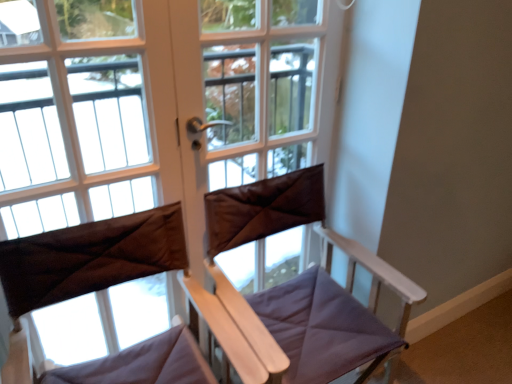
Image resolution: width=512 pixels, height=384 pixels. What are the coordinates of `purple fabric chair at center` in the screenshot? It's located at (302, 284).

Find the location of a particular element. Image resolution: width=512 pixels, height=384 pixels. brown fabric curtain at center is located at coordinates (88, 258).

You are a GUI agent. You are given a task and a screenshot of the screen. Output one action in this format:
    pyautogui.click(x=<x>, y=<y>)
    Task: Click on the purple fabric chair at center
    The image size is (512, 384).
    Given the screenshot: What is the action you would take?
    pyautogui.click(x=302, y=284)

Can you confirm if brown leather screen door at center is bigger than matte brown curtain at left?

Correct, brown leather screen door at center is larger in size than matte brown curtain at left.

Measure the distance between brown leather screen door at center and matte brown curtain at left.

brown leather screen door at center and matte brown curtain at left are 3.30 feet apart from each other.

Does brown leather screen door at center have a greater height compared to matte brown curtain at left?

No.

Consider the image. Can you confirm if brown leather screen door at center is positioned to the right of matte brown curtain at left?

Yes, brown leather screen door at center is to the right of matte brown curtain at left.

Would you consider matte brown curtain at left to be distant from brown fabric curtain at center?

Yes, matte brown curtain at left is far from brown fabric curtain at center.

Is matte brown curtain at left to the left of brown fabric curtain at center from the viewer's perspective?

Indeed, matte brown curtain at left is positioned on the left side of brown fabric curtain at center.

Is the depth of matte brown curtain at left less than that of brown fabric curtain at center?

No, it is not.

Which is in front, point (167, 218) or point (31, 141)?

Point (167, 218)

Between brown fabric curtain at center and matte brown curtain at left, which one appears on the right side from the viewer's perspective?

From the viewer's perspective, brown fabric curtain at center appears more on the right side.

Is brown fabric curtain at center situated inside matte brown curtain at left or outside?

brown fabric curtain at center is outside matte brown curtain at left.

From a real-world perspective, is brown fabric curtain at center physically located above or below matte brown curtain at left?

brown fabric curtain at center is situated lower than matte brown curtain at left in the real world.

From a real-world perspective, is purple fabric chair at center positioned over matte brown curtain at left based on gravity?

No, from a real-world perspective, purple fabric chair at center is not above matte brown curtain at left.

From the image's perspective, is purple fabric chair at center positioned above or below matte brown curtain at left?

From the image's perspective, purple fabric chair at center appears below matte brown curtain at left.

Measure the distance from purple fabric chair at center to matte brown curtain at left.

The distance of purple fabric chair at center from matte brown curtain at left is 1.33 meters.

From the picture: Which is closer to the camera, (391, 351) or (55, 109)?

Point (391, 351)

Is brown fabric at center to the left or to the right of purple fabric chair at center in the image?

brown fabric at center is to the left of purple fabric chair at center.

Considering the sizes of objects brown fabric at center and purple fabric chair at center in the image provided, who is smaller, brown fabric at center or purple fabric chair at center?

brown fabric at center is smaller.

Is the surface of brown fabric at center in direct contact with purple fabric chair at center?

No, brown fabric at center is not beside purple fabric chair at center.

In the scene shown: From the image's perspective, would you say brown fabric at center is positioned over purple fabric chair at center?

Yes, from the image's perspective, brown fabric at center is over purple fabric chair at center.

How distant is purple fabric chair at center from brown leather screen door at center?

The distance of purple fabric chair at center from brown leather screen door at center is 14.62 inches.

Does purple fabric chair at center have a larger size compared to brown leather screen door at center?

Yes, purple fabric chair at center is bigger than brown leather screen door at center.

How different are the orientations of purple fabric chair at center and brown leather screen door at center in degrees?

1.66 degrees.

From the picture: Are purple fabric chair at center and brown leather screen door at center making contact?

There is a gap between purple fabric chair at center and brown leather screen door at center.

In the scene shown: Is matte brown curtain at left touching purple fabric chair at center?

They are not placed beside each other.

Can you confirm if matte brown curtain at left is shorter than purple fabric chair at center?

Incorrect, the height of matte brown curtain at left does not fall short of that of purple fabric chair at center.

Which is behind, point (95, 111) or point (272, 288)?

The point (95, 111) is farther.

The height and width of the screenshot is (384, 512). What are the coordinates of `bay window that is below the brown leather screen door at center (from the image's perspective)` in the screenshot? It's located at (72, 116).

Where is `curtain in front of the matte brown curtain at left`? curtain in front of the matte brown curtain at left is located at coordinates (88, 258).

Looking at the image, which one is located closer to brown leather screen door at center, purple fabric chair at center or brown fabric curtain at center?

brown fabric curtain at center.

Looking at the image, which one is located further to purple fabric chair at center, brown fabric at center or brown fabric curtain at center?

brown fabric at center lies further to purple fabric chair at center than the other object.

Consider the image. Estimate the real-world distances between objects in this image. Which object is further from brown fabric curtain at center, brown leather screen door at center or matte brown curtain at left?

matte brown curtain at left is further to brown fabric curtain at center.

Estimate the real-world distances between objects in this image. Which object is closer to purple fabric chair at center, brown fabric at center or brown leather screen door at center?

Among the two, brown fabric at center is located nearer to purple fabric chair at center.

Based on the photo, considering their positions, is brown fabric at center positioned closer to matte brown curtain at left than brown leather screen door at center?

Among the two, brown fabric at center is located nearer to matte brown curtain at left.

When comparing their distances from brown fabric curtain at center, does purple fabric chair at center or brown leather screen door at center seem closer?

purple fabric chair at center is closer to brown fabric curtain at center.

Looking at the image, which one is located closer to brown fabric at center, brown leather screen door at center or matte brown curtain at left?

brown leather screen door at center lies closer to brown fabric at center than the other object.

In the scene shown: Estimate the real-world distances between objects in this image. Which object is further from brown leather screen door at center, brown fabric at center or purple fabric chair at center?

Among the two, purple fabric chair at center is located further to brown leather screen door at center.

Locate an element on the screen. This screenshot has width=512, height=384. bay window that lies between brown fabric at center and brown fabric curtain at center from top to bottom is located at coordinates (72, 116).

This screenshot has width=512, height=384. I want to click on curtain situated between matte brown curtain at left and purple fabric chair at center from left to right, so click(88, 258).

Image resolution: width=512 pixels, height=384 pixels. Find the location of `feeding chair between brown fabric at center and brown fabric curtain at center vertically`. feeding chair between brown fabric at center and brown fabric curtain at center vertically is located at coordinates (302, 284).

Find the location of a particular element. This screenshot has height=384, width=512. screen door between matte brown curtain at left and purple fabric chair at center in the horizontal direction is located at coordinates (264, 95).